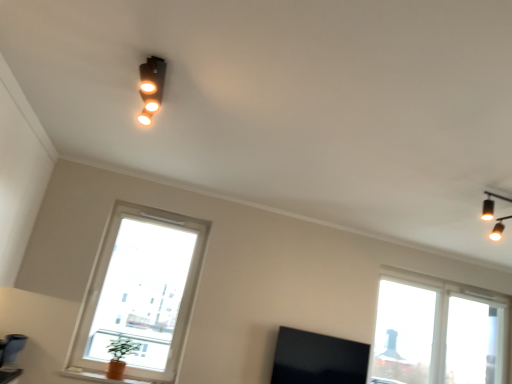
Question: From a real-world perspective, is green leafy plant at lower left on black matte tv at lower center?

Choices:
 (A) no
 (B) yes

Answer: (A)

Question: Considering the relative positions of green leafy plant at lower left and black matte tv at lower center in the image provided, is green leafy plant at lower left to the left of black matte tv at lower center from the viewer's perspective?

Choices:
 (A) yes
 (B) no

Answer: (A)

Question: Is green leafy plant at lower left positioned with its back to black matte tv at lower center?

Choices:
 (A) no
 (B) yes

Answer: (A)

Question: From the image's perspective, is green leafy plant at lower left on top of black matte tv at lower center?

Choices:
 (A) yes
 (B) no

Answer: (A)

Question: Does green leafy plant at lower left have a lesser width compared to black matte tv at lower center?

Choices:
 (A) yes
 (B) no

Answer: (B)

Question: From a real-world perspective, is black matte tv at lower center above or below transparent glass window at lower left, placed as the first window when sorted from left to right?

Choices:
 (A) below
 (B) above

Answer: (A)

Question: Is black matte tv at lower center taller or shorter than transparent glass window at lower left, positioned as the second window in right-to-left order?

Choices:
 (A) short
 (B) tall

Answer: (A)

Question: Does point (337, 382) appear closer or farther from the camera than point (119, 289)?

Choices:
 (A) closer
 (B) farther

Answer: (B)

Question: From the image's perspective, is black matte tv at lower center located above or below transparent glass window at lower left, the second window in the back-to-front sequence?

Choices:
 (A) above
 (B) below

Answer: (B)

Question: Considering the positions of transparent glass window at right, positioned as the 1th window in right-to-left order, and matte orange vase at lower left in the image, is transparent glass window at right, positioned as the 1th window in right-to-left order, taller or shorter than matte orange vase at lower left?

Choices:
 (A) tall
 (B) short

Answer: (A)

Question: Looking at the image, does transparent glass window at right, the first window viewed from the back, seem bigger or smaller compared to matte orange vase at lower left?

Choices:
 (A) big
 (B) small

Answer: (A)

Question: Considering the positions of transparent glass window at right, positioned as the 1th window in right-to-left order, and matte orange vase at lower left in the image, is transparent glass window at right, positioned as the 1th window in right-to-left order, wider or thinner than matte orange vase at lower left?

Choices:
 (A) wide
 (B) thin

Answer: (A)

Question: In the image, is transparent glass window at right, which is the 2th window from front to back, on the left side or the right side of matte orange vase at lower left?

Choices:
 (A) right
 (B) left

Answer: (A)

Question: From a real-world perspective, is matte black spotlight at upper center positioned above or below green leafy plant at lower left?

Choices:
 (A) below
 (B) above

Answer: (B)

Question: Which is correct: matte black spotlight at upper center is inside green leafy plant at lower left, or outside of it?

Choices:
 (A) inside
 (B) outside

Answer: (B)